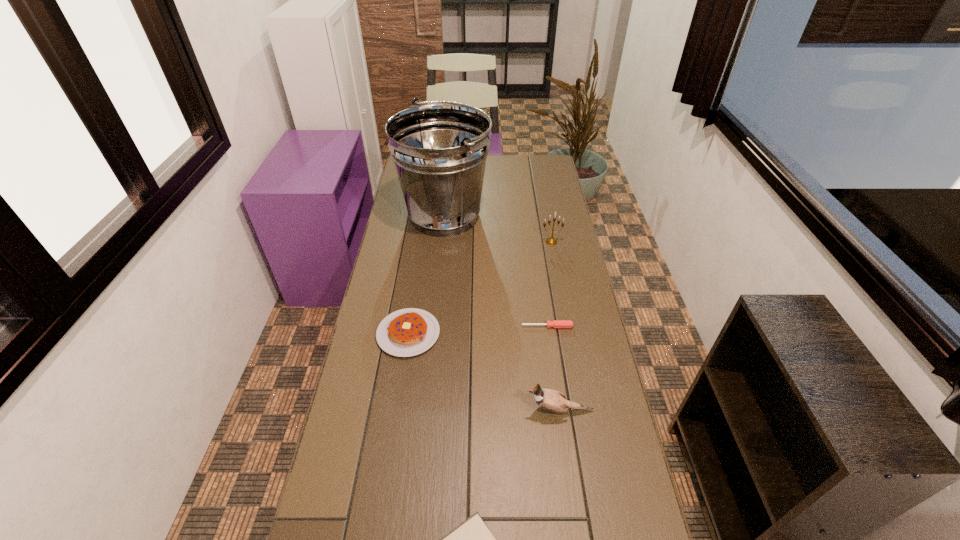
At what (x,y) coordinates should I click in order to perform the action: click on bucket. Please return your answer as a coordinate pair (x, y). This screenshot has width=960, height=540. Looking at the image, I should click on (439, 150).

At what (x,y) coordinates should I click in order to perform the action: click on candelabrum. Please return your answer as a coordinate pair (x, y). This screenshot has height=540, width=960. Looking at the image, I should click on click(x=551, y=241).

You are a GUI agent. You are given a task and a screenshot of the screen. Output one action in this format:
    pyautogui.click(x=<x>, y=<y>)
    Task: Click on the bird
    This screenshot has width=960, height=540.
    Given the screenshot: What is the action you would take?
    pyautogui.click(x=551, y=400)

Image resolution: width=960 pixels, height=540 pixels. I want to click on pancake, so click(x=407, y=332).

You are a GUI agent. You are given a task and a screenshot of the screen. Output one action in this format:
    pyautogui.click(x=<x>, y=<y>)
    Task: Click on the screwdriver
    Image resolution: width=960 pixels, height=540 pixels.
    Given the screenshot: What is the action you would take?
    pyautogui.click(x=555, y=323)

Image resolution: width=960 pixels, height=540 pixels. What are the coordinates of `vacant space situated on the front of the tallest object` in the screenshot? It's located at (438, 287).

Find the location of `vacant area situated 0.300m on the front of the candelabrum`. vacant area situated 0.300m on the front of the candelabrum is located at coordinates (563, 300).

Where is `free space located at the face of the fifth farthest object`? The height and width of the screenshot is (540, 960). free space located at the face of the fifth farthest object is located at coordinates (502, 410).

Locate an element on the screen. blank space located 0.160m at the face of the fifth farthest object is located at coordinates point(466,410).

Where is `vacant space located at the face of the fifth farthest object`? Image resolution: width=960 pixels, height=540 pixels. vacant space located at the face of the fifth farthest object is located at coordinates (444, 410).